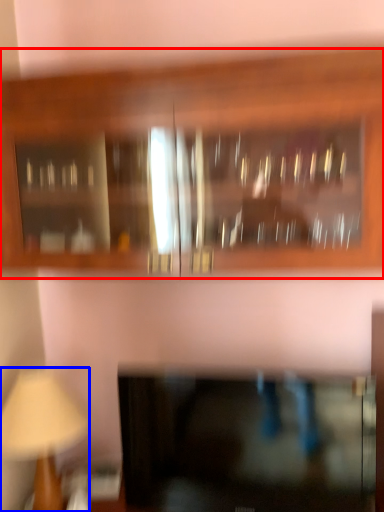
Question: Which of the following is the farthest to the observer, cabinetry (highlighted by a red box) or table lamp (highlighted by a blue box)?

Choices:
 (A) cabinetry
 (B) table lamp

Answer: (B)